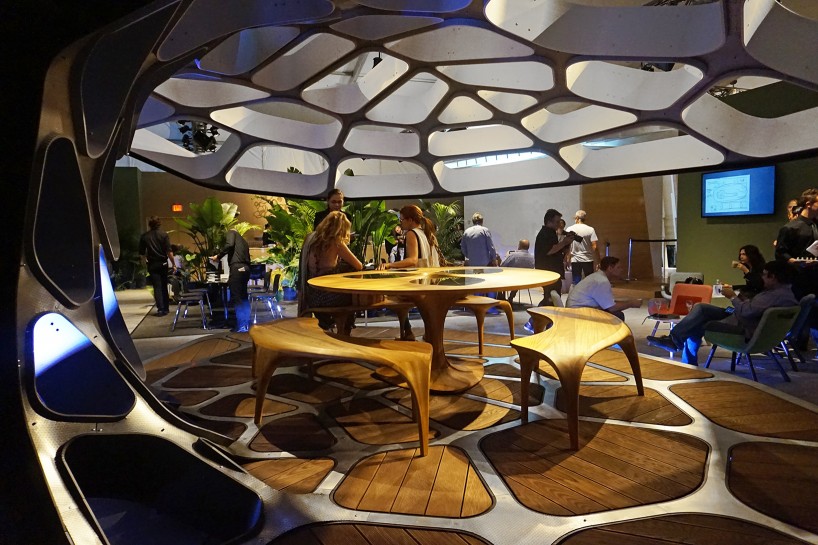
The width and height of the screenshot is (818, 545). In order to click on modern style wooden benches at large wooden table in this screenshot , I will do pos(578,317), pos(573,357), pos(388,354), pos(280,334).